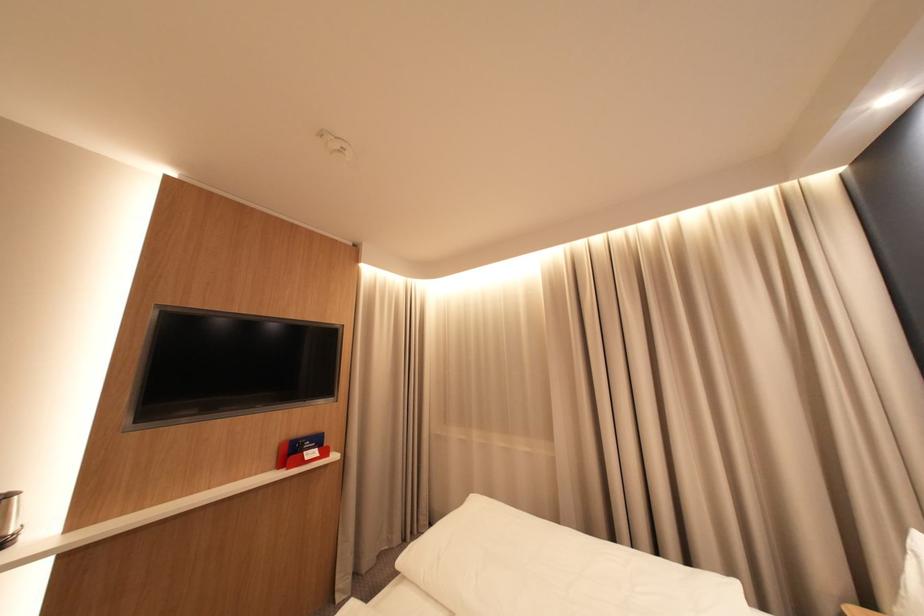
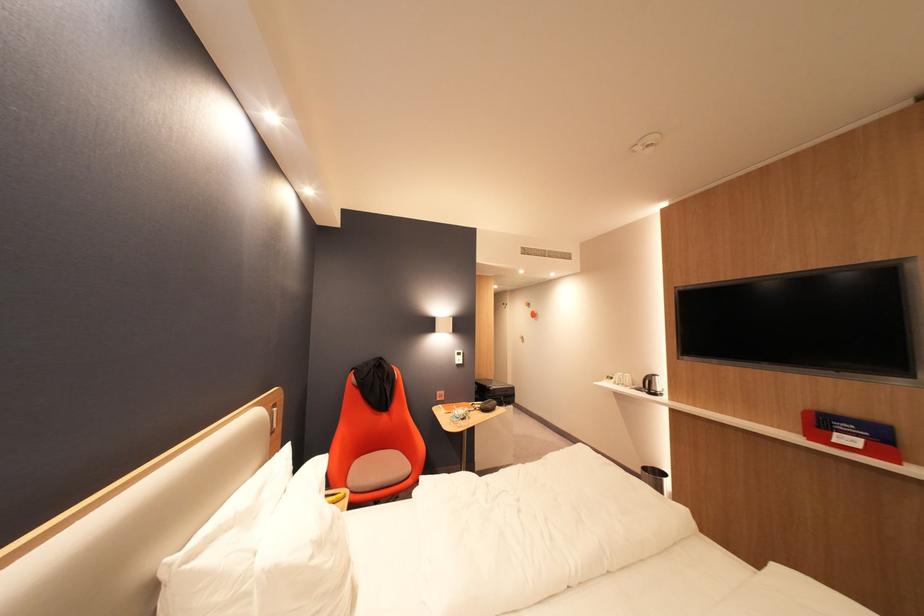
The point at [314,455] is marked in the first image. Where is the corresponding point in the second image?

(846, 435)